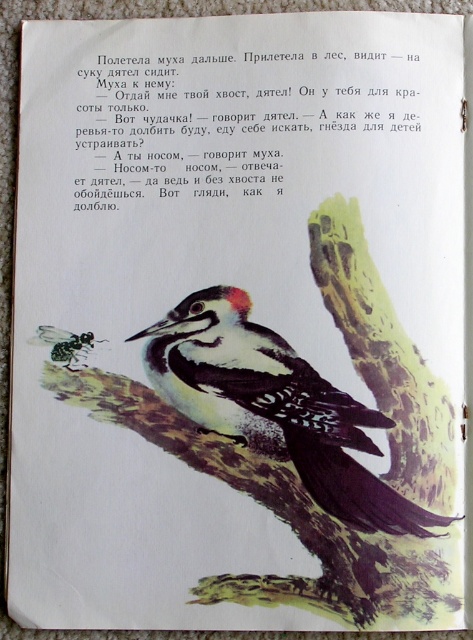
Question: Is speckled feathered woodpecker at center thinner than black glossy ant at lower left?

Choices:
 (A) yes
 (B) no

Answer: (B)

Question: Which object appears closest to the camera in this image?

Choices:
 (A) black glossy ant at lower left
 (B) speckled feathered woodpecker at center

Answer: (B)

Question: Which of the following is the closest to the observer?

Choices:
 (A) (134, 333)
 (B) (58, 340)

Answer: (A)

Question: Can you confirm if speckled feathered woodpecker at center is wider than black glossy ant at lower left?

Choices:
 (A) yes
 (B) no

Answer: (A)

Question: Is speckled feathered woodpecker at center thinner than black glossy ant at lower left?

Choices:
 (A) yes
 (B) no

Answer: (B)